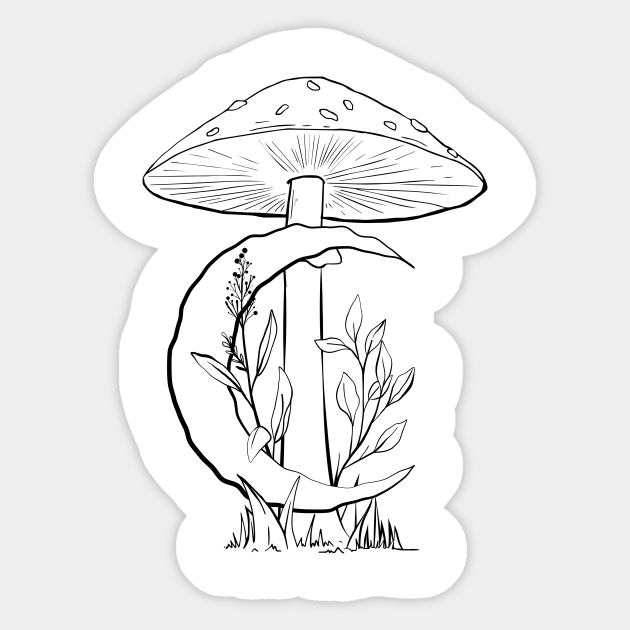
Find the location of `plant`. plant is located at coordinates (251, 401), (363, 408).